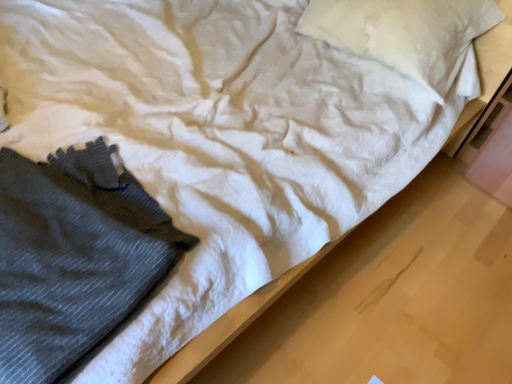
Question: Considering the relative positions of dark gray knitted sweater at lower left and white cotton pillow at upper center in the image provided, is dark gray knitted sweater at lower left behind white cotton pillow at upper center?

Choices:
 (A) no
 (B) yes

Answer: (A)

Question: From the image's perspective, would you say dark gray knitted sweater at lower left is shown under white cotton pillow at upper center?

Choices:
 (A) no
 (B) yes

Answer: (B)

Question: Can you confirm if dark gray knitted sweater at lower left is bigger than white cotton pillow at upper center?

Choices:
 (A) no
 (B) yes

Answer: (A)

Question: Can you confirm if dark gray knitted sweater at lower left is positioned to the right of white cotton pillow at upper center?

Choices:
 (A) yes
 (B) no

Answer: (B)

Question: Can you confirm if dark gray knitted sweater at lower left is smaller than white cotton pillow at upper center?

Choices:
 (A) no
 (B) yes

Answer: (B)

Question: Are dark gray knitted sweater at lower left and white cotton pillow at upper center beside each other?

Choices:
 (A) yes
 (B) no

Answer: (B)

Question: Is white cotton pillow at upper center not inside dark gray knitted sweater at lower left?

Choices:
 (A) yes
 (B) no

Answer: (A)

Question: Is white cotton pillow at upper center positioned behind dark gray knitted sweater at lower left?

Choices:
 (A) yes
 (B) no

Answer: (A)

Question: From a real-world perspective, is white cotton pillow at upper center positioned under dark gray knitted sweater at lower left based on gravity?

Choices:
 (A) yes
 (B) no

Answer: (B)

Question: Can you confirm if white cotton pillow at upper center is positioned to the left of dark gray knitted sweater at lower left?

Choices:
 (A) no
 (B) yes

Answer: (A)

Question: From the image's perspective, does white cotton pillow at upper center appear higher than dark gray knitted sweater at lower left?

Choices:
 (A) no
 (B) yes

Answer: (B)

Question: From a real-world perspective, is white cotton pillow at upper center physically above dark gray knitted sweater at lower left?

Choices:
 (A) yes
 (B) no

Answer: (A)

Question: In terms of width, does dark gray knitted sweater at lower left look wider or thinner when compared to white cotton pillow at upper center?

Choices:
 (A) thin
 (B) wide

Answer: (A)